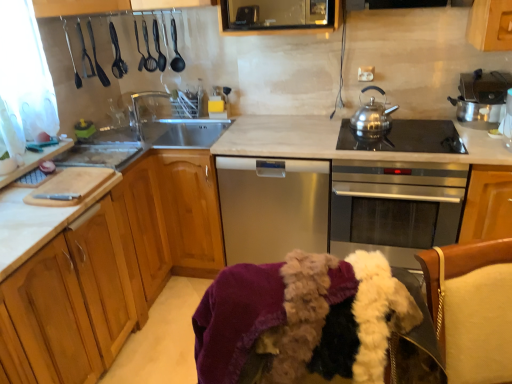
Where is `free space above satin silver dishwasher at center (from a real-world perspective)`? The image size is (512, 384). free space above satin silver dishwasher at center (from a real-world perspective) is located at coordinates (276, 130).